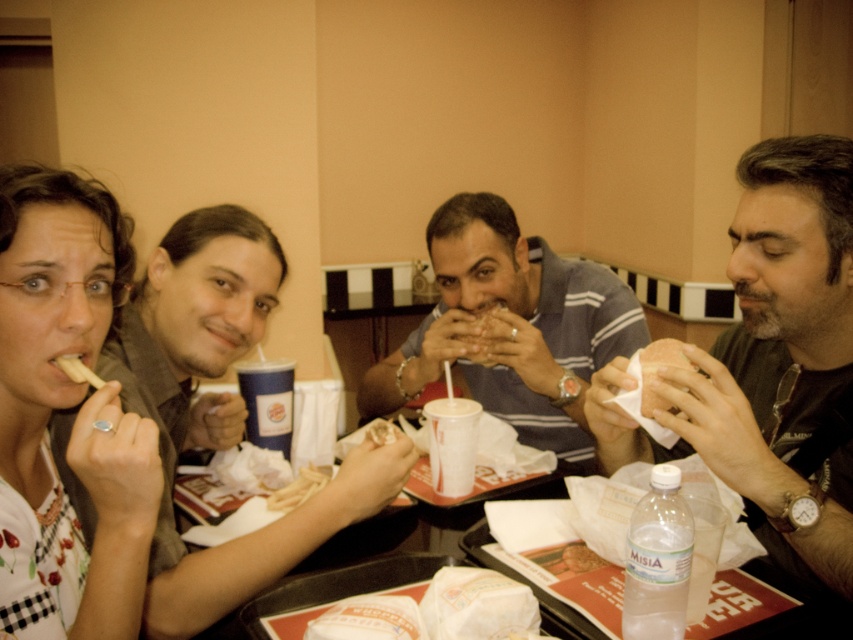
You are sitting at the table and want to grab the white matte french fries at lower left. Is the smooth brown shirt at left blocking your direct path to the fries?

The smooth brown shirt at left is further to the viewer than the white matte french fries at lower left, so it is closer to you and blocking the direct path to the fries.